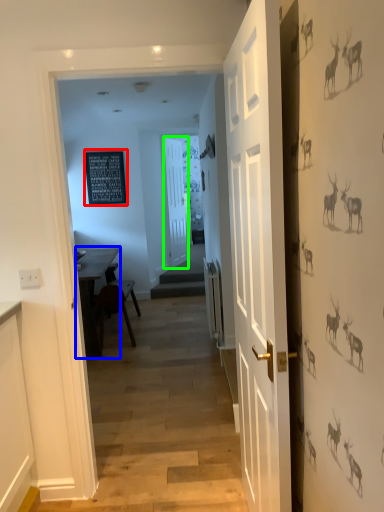
Question: Which object is the closest to the bulletin board (highlighted by a red box)? Choose among these: table (highlighted by a blue box) or door (highlighted by a green box).

Choices:
 (A) table
 (B) door

Answer: (B)